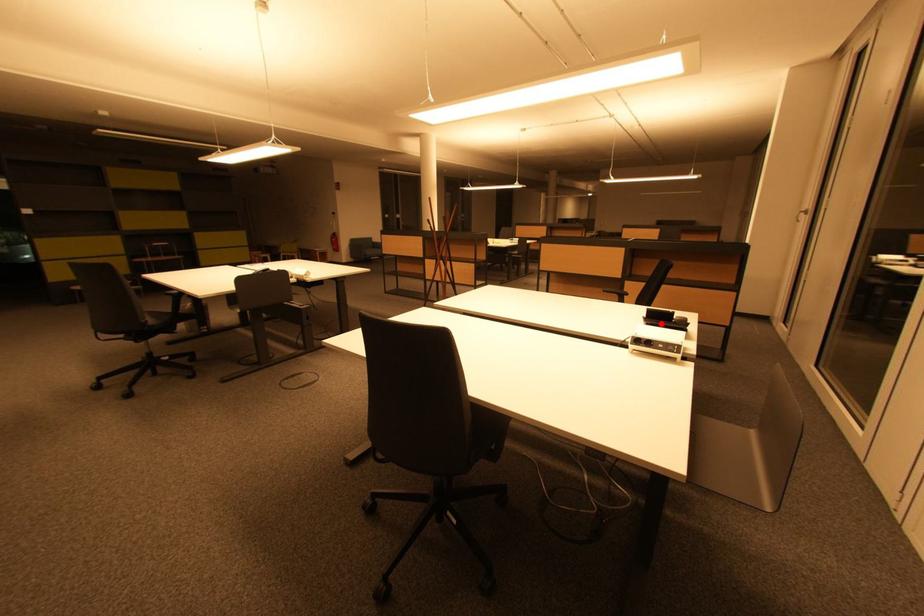
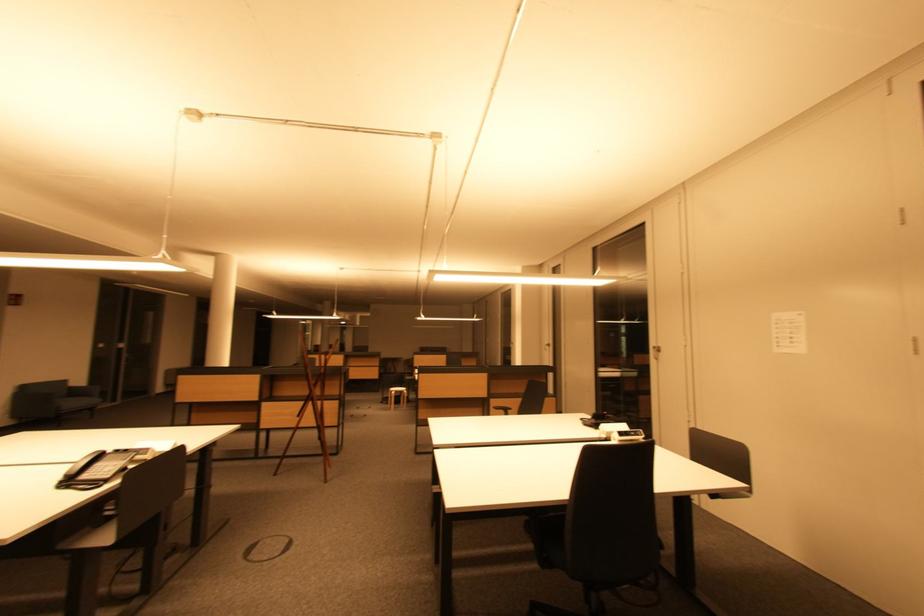
Question: I am providing you with two images of the same scene from different viewpoints. A red point is marked on the first image. At the location where the point appears in image 1, is it still visible in image 2?

Choices:
 (A) Yes
 (B) No

Answer: (A)